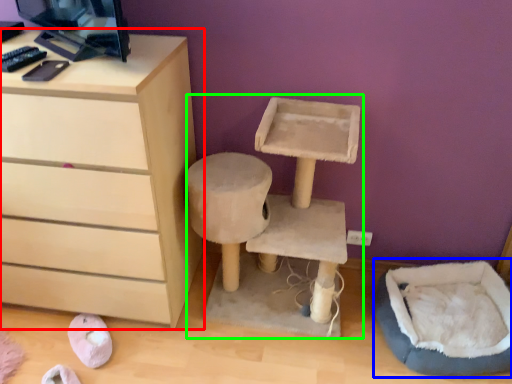
Question: Based on their relative distances, which object is farther from chest of drawers (highlighted by a red box)? Choose from bean bag chair (highlighted by a blue box) and computer desk (highlighted by a green box).

Choices:
 (A) bean bag chair
 (B) computer desk

Answer: (A)